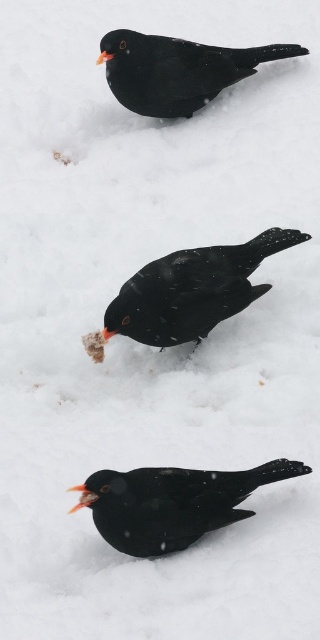
Between shiny black bird at center and shiny black crow at upper center, which one appears on the right side from the viewer's perspective?

shiny black crow at upper center is more to the right.

Looking at this image, is shiny black bird at center positioned at the back of shiny black crow at upper center?

No, shiny black bird at center is closer to the viewer.

Locate an element on the screen. This screenshot has width=320, height=640. shiny black bird at center is located at coordinates (171, 502).

Does matte black bird at center lie behind shiny black crow at upper center?

That is False.

Does matte black bird at center appear on the right side of shiny black crow at upper center?

Yes, matte black bird at center is to the right of shiny black crow at upper center.

Between point (168, 342) and point (117, 58), which one is positioned in front?

Point (168, 342) is in front.

Where is `matte black bird at center`? This screenshot has height=640, width=320. matte black bird at center is located at coordinates (192, 291).

Between point (94, 500) and point (243, 257), which one is positioned in front?

Positioned in front is point (94, 500).

Is point (141, 483) in front of point (208, 289)?

Yes.

What are the coordinates of `shiny black bird at center` in the screenshot? It's located at (171, 502).